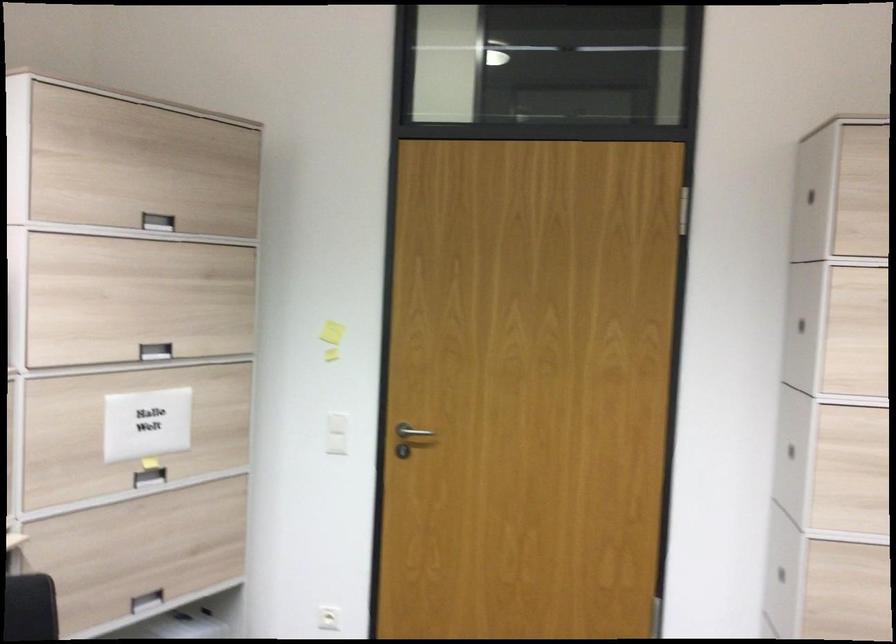
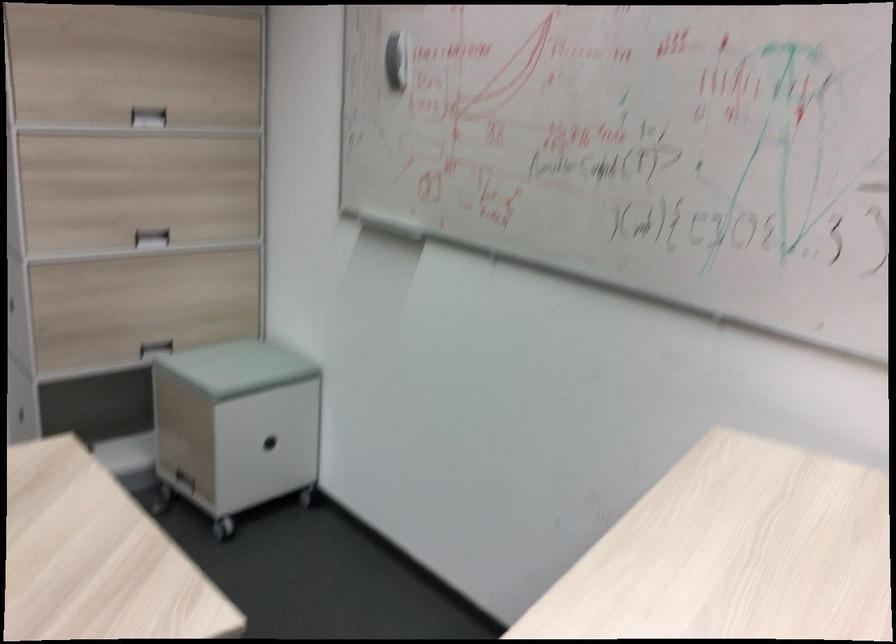
The images are taken continuously from a first-person perspective. In which direction is your viewpoint rotating?

The rotation direction of the camera is right-down.